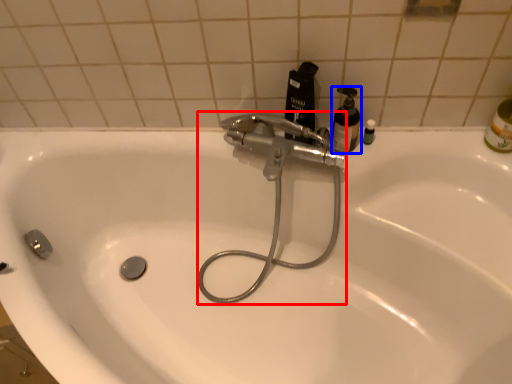
Question: Among these objects, which one is farthest to the camera, plumbing fixture (highlighted by a red box) or mouthwash (highlighted by a blue box)?

Choices:
 (A) plumbing fixture
 (B) mouthwash

Answer: (B)